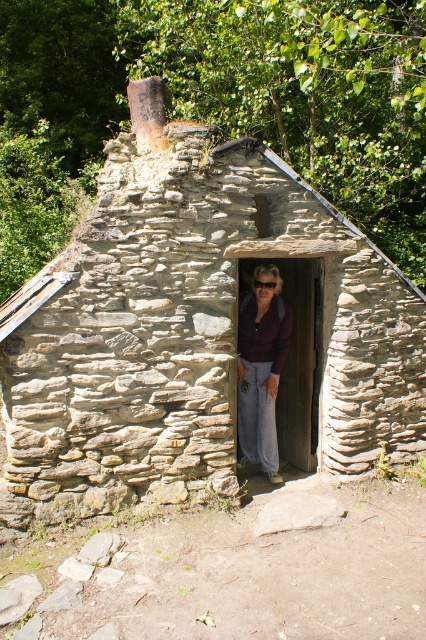
You are an outdoor photographer who wants to capture both the rustic stone cabin at center and the matte purple shirt at center in a single frame. Which object should you focus on first to ensure both are in the frame?

The rustic stone cabin at center is bigger than the matte purple shirt at center, so you should focus on the rustic stone cabin at center first to ensure both are in the frame.

You are standing in a natural setting and see the rustic stone cabin at center and the matte purple shirt at center. Which object is positioned to the left?

The rustic stone cabin at center is positioned to the left of the matte purple shirt at center.

You are a delivery person carrying a package that requires a 1 meter minimum distance from flammable materials. You see the rustic stone cabin at center and the matte purple shirt at center. Can you place the package between them?

The distance between the rustic stone cabin at center and the matte purple shirt at center is 80.13 centimeters, which is less than the required 1 meter. Therefore, you cannot place the package between them as it does not meet the safety requirement.